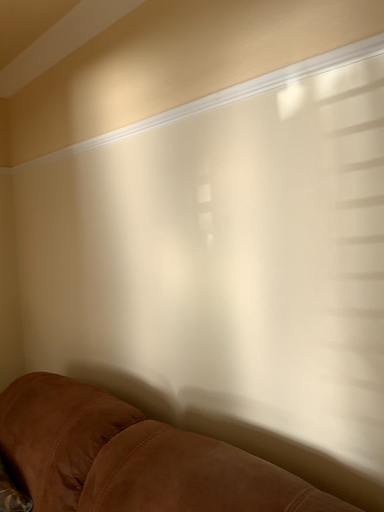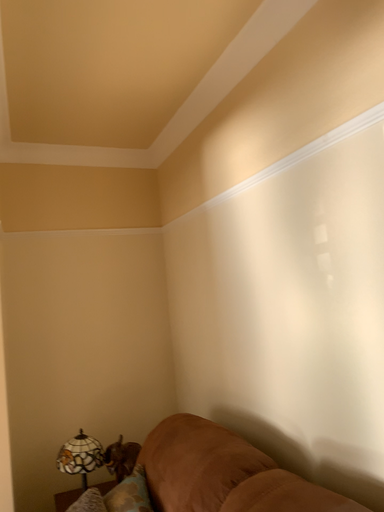
Question: Which way did the camera rotate in the video?

Choices:
 (A) rotated left
 (B) rotated right

Answer: (A)